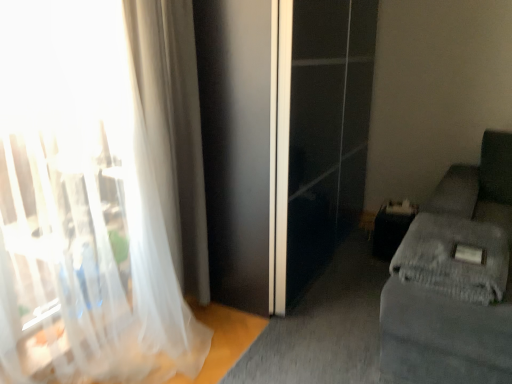
Question: Can we say white sheer curtain at left, arranged as the 1th curtain when viewed from the front, lies outside translucent fabric curtain at left, which ranks as the 1th curtain in back-to-front order?

Choices:
 (A) no
 (B) yes

Answer: (B)

Question: Considering the relative sizes of white sheer curtain at left, positioned as the 2th curtain in back-to-front order, and translucent fabric curtain at left, arranged as the 2th curtain when viewed from the front, in the image provided, is white sheer curtain at left, positioned as the 2th curtain in back-to-front order, thinner than translucent fabric curtain at left, arranged as the 2th curtain when viewed from the front,?

Choices:
 (A) yes
 (B) no

Answer: (A)

Question: Is white sheer curtain at left, positioned as the 2th curtain in back-to-front order, wider than translucent fabric curtain at left, which ranks as the 1th curtain in back-to-front order?

Choices:
 (A) no
 (B) yes

Answer: (A)

Question: Does white sheer curtain at left, arranged as the 1th curtain when viewed from the front, appear on the left side of translucent fabric curtain at left, arranged as the 2th curtain when viewed from the front?

Choices:
 (A) yes
 (B) no

Answer: (A)

Question: Is white sheer curtain at left, arranged as the 1th curtain when viewed from the front, positioned far away from translucent fabric curtain at left, arranged as the 2th curtain when viewed from the front?

Choices:
 (A) no
 (B) yes

Answer: (A)

Question: From the image's perspective, is translucent fabric curtain at left, which ranks as the 1th curtain in back-to-front order, positioned above or below white sheer curtain at left, positioned as the 2th curtain in back-to-front order?

Choices:
 (A) below
 (B) above

Answer: (B)

Question: Looking at their shapes, would you say translucent fabric curtain at left, arranged as the 2th curtain when viewed from the front, is wider or thinner than white sheer curtain at left, arranged as the 1th curtain when viewed from the front?

Choices:
 (A) wide
 (B) thin

Answer: (A)

Question: In terms of size, does translucent fabric curtain at left, which ranks as the 1th curtain in back-to-front order, appear bigger or smaller than white sheer curtain at left, positioned as the 2th curtain in back-to-front order?

Choices:
 (A) big
 (B) small

Answer: (B)

Question: Is translucent fabric curtain at left, which ranks as the 1th curtain in back-to-front order, in front of or behind white sheer curtain at left, arranged as the 1th curtain when viewed from the front, in the image?

Choices:
 (A) behind
 (B) front

Answer: (A)

Question: From a real-world perspective, relative to gray fabric couch at right, is white sheer curtain at left, arranged as the 1th curtain when viewed from the front, vertically above or below?

Choices:
 (A) above
 (B) below

Answer: (A)

Question: Which is correct: white sheer curtain at left, arranged as the 1th curtain when viewed from the front, is inside gray fabric couch at right, or outside of it?

Choices:
 (A) outside
 (B) inside

Answer: (A)

Question: From the image's perspective, is white sheer curtain at left, positioned as the 2th curtain in back-to-front order, located above or below gray fabric couch at right?

Choices:
 (A) above
 (B) below

Answer: (A)

Question: Looking at their shapes, would you say white sheer curtain at left, positioned as the 2th curtain in back-to-front order, is wider or thinner than gray fabric couch at right?

Choices:
 (A) thin
 (B) wide

Answer: (A)

Question: Visually, is white sheer curtain at left, arranged as the 1th curtain when viewed from the front, positioned to the left or to the right of gray textured blanket at lower right?

Choices:
 (A) right
 (B) left

Answer: (B)

Question: From the image's perspective, is white sheer curtain at left, arranged as the 1th curtain when viewed from the front, above or below gray textured blanket at lower right?

Choices:
 (A) below
 (B) above

Answer: (B)